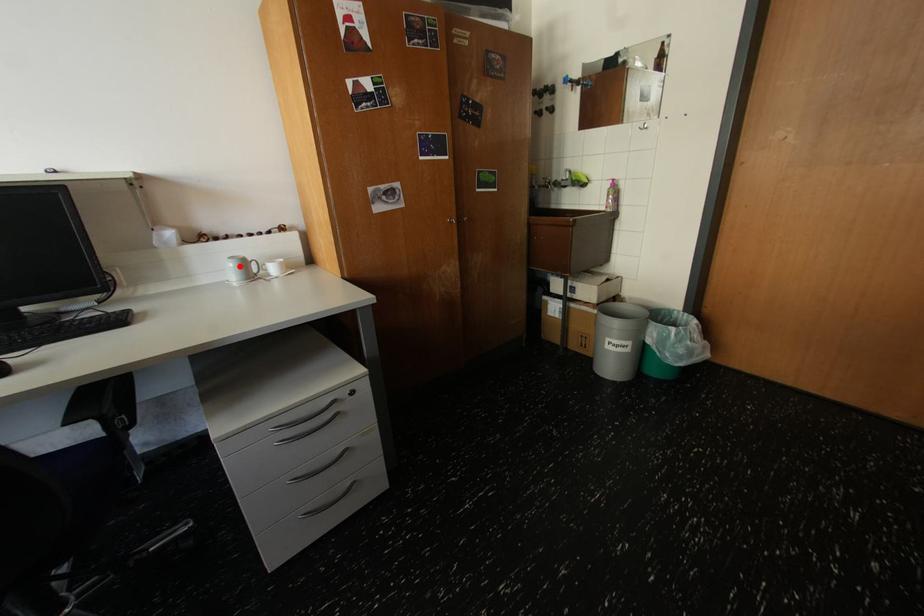
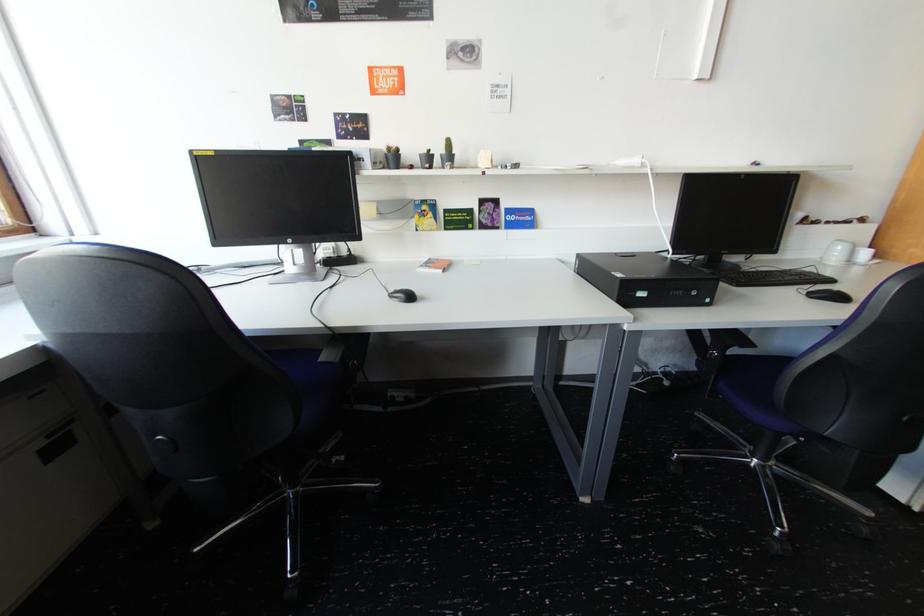
Find the pixel in the second image that matches the highlighted location in the first image.

(849, 249)